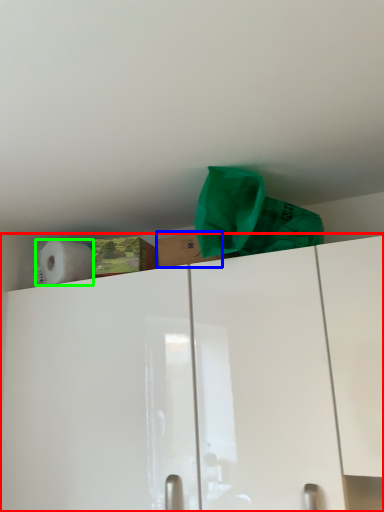
Question: Which is farther away from cabinetry (highlighted by a red box)? cardboard box (highlighted by a blue box) or paper towel (highlighted by a green box)?

Choices:
 (A) cardboard box
 (B) paper towel

Answer: (B)